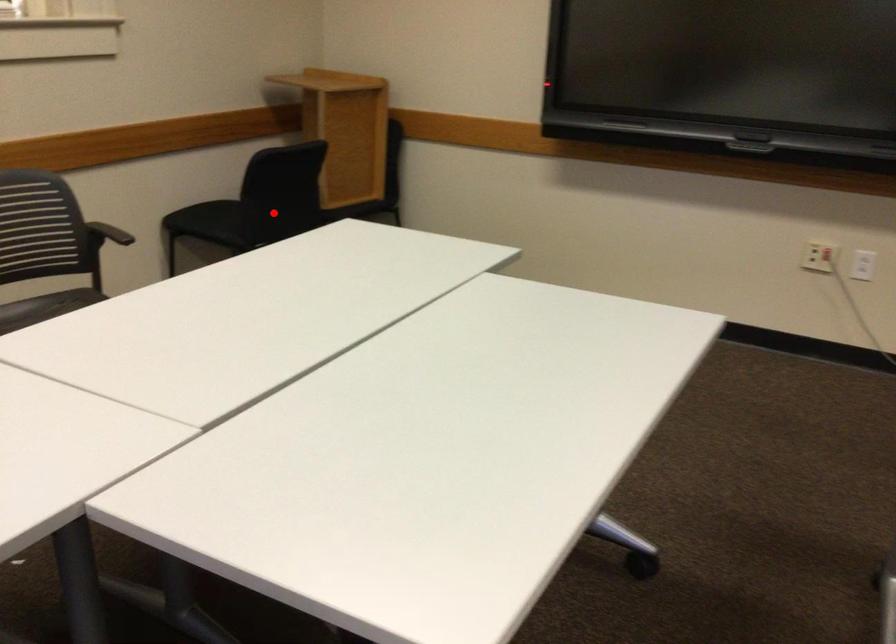
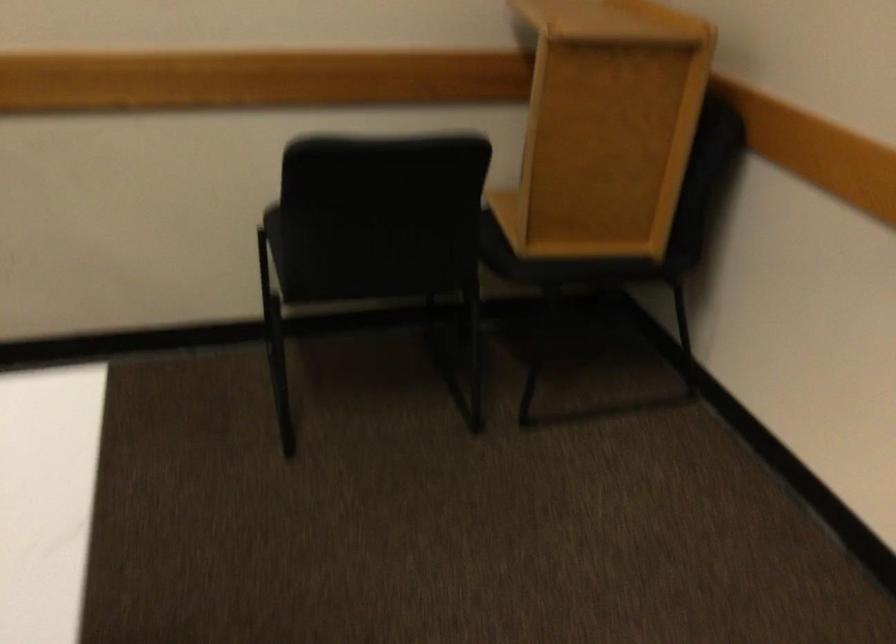
In the second image, find the point that corresponds to the highlighted location in the first image.

(348, 250)